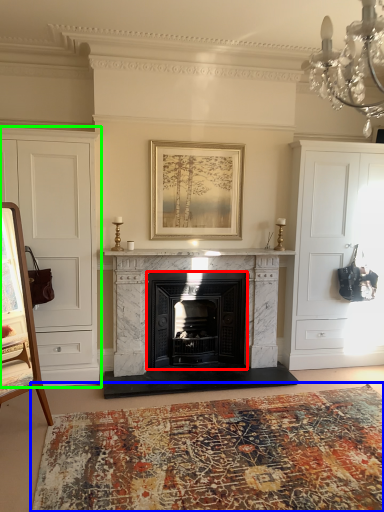
Question: Which object is the closest to the fireplace (highlighted by a red box)? Choose among these: plain (highlighted by a blue box) or cabinetry (highlighted by a green box).

Choices:
 (A) plain
 (B) cabinetry

Answer: (B)